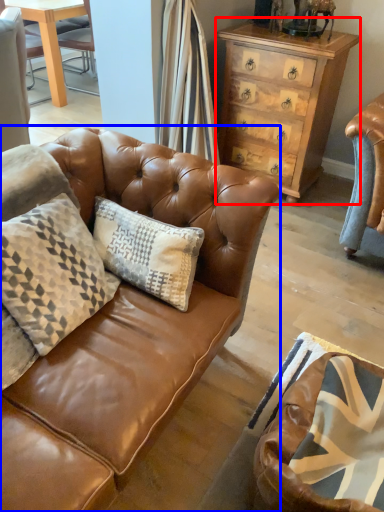
Question: Which object is further to the camera taking this photo, chest of drawers (highlighted by a red box) or studio couch (highlighted by a blue box)?

Choices:
 (A) chest of drawers
 (B) studio couch

Answer: (A)